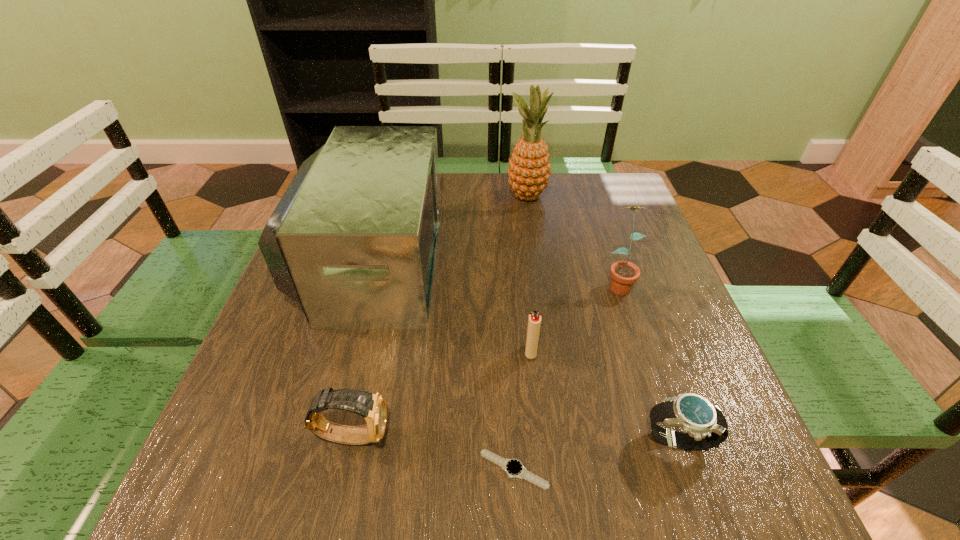
This screenshot has width=960, height=540. In order to click on free space located 0.300m on the left of the pineapple in this screenshot , I will do `click(399, 197)`.

Where is `free space located on the front-facing side of the microwave oven`? free space located on the front-facing side of the microwave oven is located at coordinates (499, 260).

Where is `free space located on the flower of the fifth shortest object`? The width and height of the screenshot is (960, 540). free space located on the flower of the fifth shortest object is located at coordinates (643, 358).

I want to click on vacant space situated on the face of the leftmost watch, so click(x=527, y=435).

At what (x,y) coordinates should I click in order to perform the action: click on free location located on the front of the igniter. Please return your answer as a coordinate pair (x, y). The image size is (960, 540). Looking at the image, I should click on (543, 471).

Find the location of a particular element. The width and height of the screenshot is (960, 540). free space located 0.230m on the left of the second shortest object is located at coordinates (503, 442).

At what (x,y) coordinates should I click in order to perform the action: click on vacant space situated on the left of the shortest object. Please return your answer as a coordinate pair (x, y). The width and height of the screenshot is (960, 540). Looking at the image, I should click on (243, 469).

Where is `pineapple at the far edge`? pineapple at the far edge is located at coordinates (529, 169).

What are the coordinates of `microwave oven situated at the far edge` in the screenshot? It's located at (353, 240).

Where is `object present at the left edge`? This screenshot has height=540, width=960. object present at the left edge is located at coordinates (353, 240).